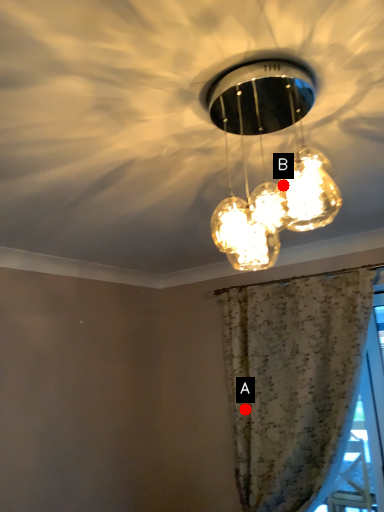
Question: Two points are circled on the image, labeled by A and B beside each circle. Which point is closer to the camera?

Choices:
 (A) A is closer
 (B) B is closer

Answer: (B)